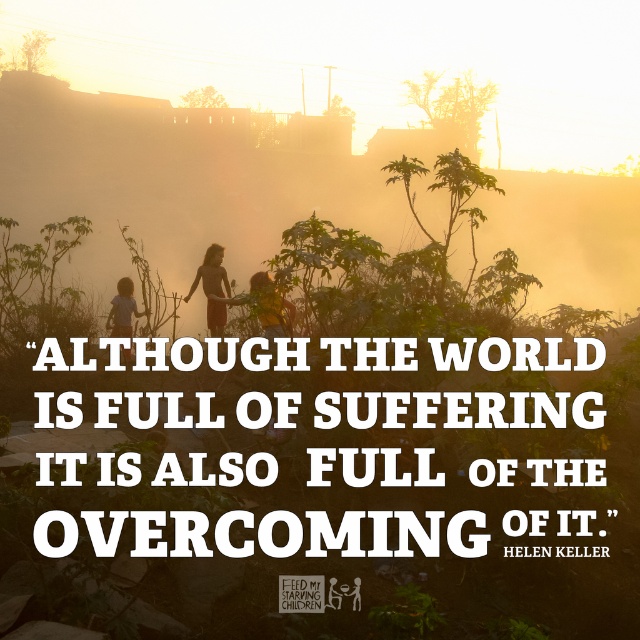
Question: Which object is the closest to the yellow shirt at center?

Choices:
 (A) matte brown dress at center
 (B) light brown wooden stick at lower left

Answer: (A)

Question: Can you confirm if yellow shirt at center is positioned to the right of light brown wooden stick at lower left?

Choices:
 (A) yes
 (B) no

Answer: (A)

Question: Is matte brown dress at center wider than light brown wooden stick at lower left?

Choices:
 (A) no
 (B) yes

Answer: (B)

Question: Does yellow shirt at center have a lesser width compared to light brown wooden stick at lower left?

Choices:
 (A) yes
 (B) no

Answer: (A)

Question: Based on their relative distances, which object is farther from the yellow shirt at center?

Choices:
 (A) matte brown dress at center
 (B) light brown wooden stick at lower left

Answer: (B)

Question: Which of the following is the closest to the observer?

Choices:
 (A) (212, 321)
 (B) (118, 282)
 (C) (262, 289)

Answer: (C)